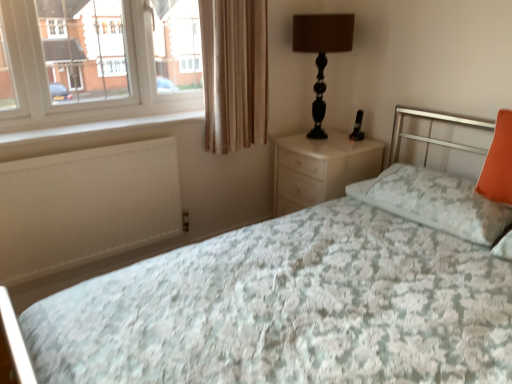
Question: From a real-world perspective, is white matte radiator at lower left located higher than orange fabric pillow at right, which is counted as the second pillow, starting from the left?

Choices:
 (A) no
 (B) yes

Answer: (A)

Question: Can you confirm if white matte radiator at lower left is thinner than orange fabric pillow at right, which is counted as the second pillow, starting from the left?

Choices:
 (A) no
 (B) yes

Answer: (B)

Question: Does white matte radiator at lower left come in front of orange fabric pillow at right, which is counted as the second pillow, starting from the left?

Choices:
 (A) no
 (B) yes

Answer: (A)

Question: Is white matte radiator at lower left beside orange fabric pillow at right, which is counted as the second pillow, starting from the left?

Choices:
 (A) no
 (B) yes

Answer: (A)

Question: From the image's perspective, would you say white matte radiator at lower left is positioned over orange fabric pillow at right, which is counted as the second pillow, starting from the left?

Choices:
 (A) yes
 (B) no

Answer: (B)

Question: Considering the relative sizes of white matte radiator at lower left and orange fabric pillow at right, which ranks as the 1th pillow in right-to-left order, in the image provided, is white matte radiator at lower left bigger than orange fabric pillow at right, which ranks as the 1th pillow in right-to-left order,?

Choices:
 (A) yes
 (B) no

Answer: (A)

Question: From the image's perspective, is white glossy nightstand at center below floral fabric bed at center?

Choices:
 (A) no
 (B) yes

Answer: (A)

Question: Does white glossy nightstand at center have a greater width compared to floral fabric bed at center?

Choices:
 (A) yes
 (B) no

Answer: (B)

Question: Is white glossy nightstand at center behind floral fabric bed at center?

Choices:
 (A) yes
 (B) no

Answer: (A)

Question: Is white glossy nightstand at center outside floral fabric bed at center?

Choices:
 (A) yes
 (B) no

Answer: (A)

Question: Can you confirm if white glossy nightstand at center is taller than floral fabric bed at center?

Choices:
 (A) yes
 (B) no

Answer: (B)

Question: Does white glossy nightstand at center have a lesser height compared to floral fabric bed at center?

Choices:
 (A) yes
 (B) no

Answer: (A)

Question: Is beige fabric curtain at upper left positioned behind white matte radiator at lower left?

Choices:
 (A) no
 (B) yes

Answer: (B)